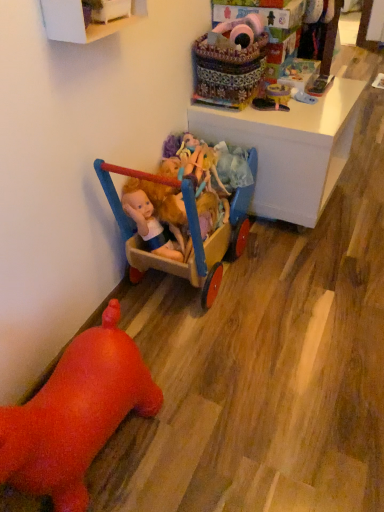
Where is `free space in front of white glossy desk at upper center`? Image resolution: width=384 pixels, height=512 pixels. free space in front of white glossy desk at upper center is located at coordinates (313, 266).